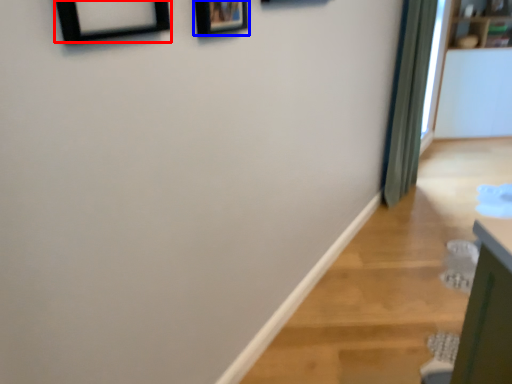
Question: Which point is closer to the camera, picture frame (highlighted by a red box) or picture frame (highlighted by a blue box)?

Choices:
 (A) picture frame
 (B) picture frame

Answer: (A)